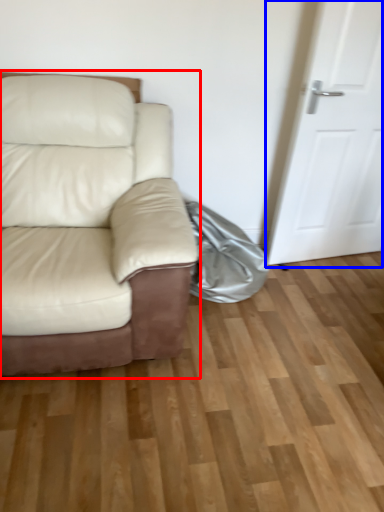
Question: Which of the following is the closest to the observer, studio couch (highlighted by a red box) or door (highlighted by a blue box)?

Choices:
 (A) studio couch
 (B) door

Answer: (A)